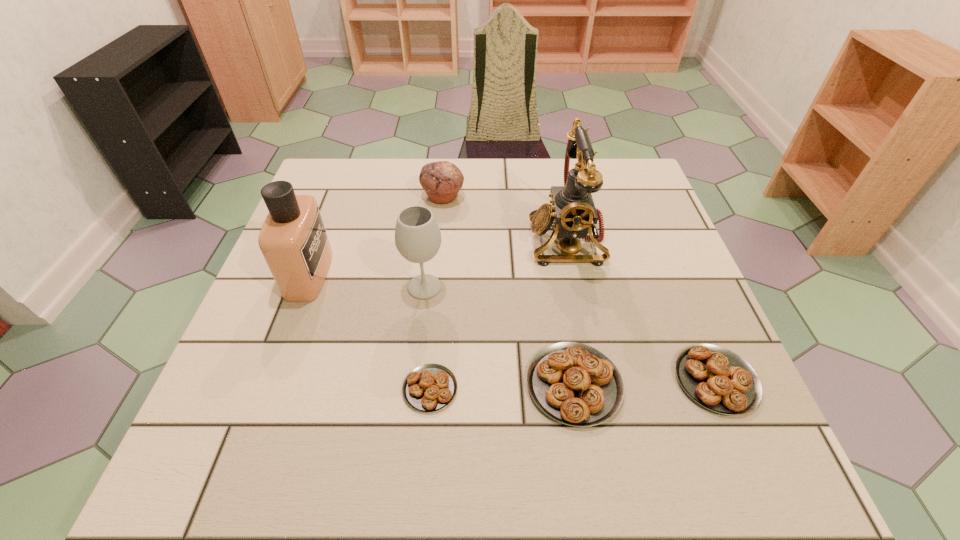
The width and height of the screenshot is (960, 540). What are the coordinates of `free spot between the second pastry from right to left and the second shortest object` in the screenshot? It's located at (645, 382).

Identify the location of vacant area between the third tallest object and the rightmost pastry. (570, 333).

Where is `vacant area between the shortest object and the tallest object`? The image size is (960, 540). vacant area between the shortest object and the tallest object is located at coordinates (498, 315).

Identify the location of free point between the second pastry from right to left and the leftmost pastry. Image resolution: width=960 pixels, height=540 pixels. (502, 387).

The image size is (960, 540). Find the location of `empty space between the leftmost object and the third tallest object`. empty space between the leftmost object and the third tallest object is located at coordinates (367, 280).

Find the location of `free spot between the telephone and the second pastry from left to right`. free spot between the telephone and the second pastry from left to right is located at coordinates (570, 312).

I want to click on empty space that is in between the leftmost object and the second pastry from right to left, so click(442, 329).

Identify the location of vacant area that lies between the sixth tallest object and the tallest object. Image resolution: width=960 pixels, height=540 pixels. (641, 310).

This screenshot has width=960, height=540. I want to click on vacant area between the second pastry from left to right and the second tallest pastry, so click(x=645, y=382).

I want to click on the fifth closest object relative to the sixth tallest object, so click(442, 180).